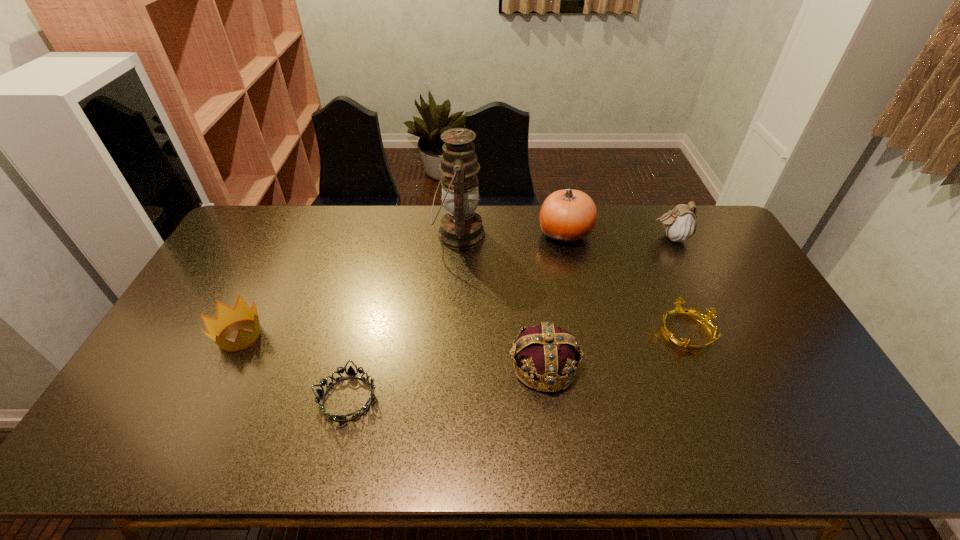
Image resolution: width=960 pixels, height=540 pixels. In the image, there is a desktop. Find the location of `free region at the near right corner`. free region at the near right corner is located at coordinates (808, 453).

You are a GUI agent. You are given a task and a screenshot of the screen. Output one action in this format:
    pyautogui.click(x=<x>, y=<y>)
    Task: Click on the free area in between the second object from left to right and the fifth tallest object
    The height and width of the screenshot is (540, 960).
    Given the screenshot: What is the action you would take?
    pyautogui.click(x=294, y=367)

The width and height of the screenshot is (960, 540). What are the coordinates of `free spot between the lantern and the second crown from left to right` in the screenshot? It's located at (501, 300).

Where is `free space that is in between the sixth shortest object and the shortest crown`? free space that is in between the sixth shortest object and the shortest crown is located at coordinates (625, 282).

Where is `unoccupied position between the leftmost crown and the pumpkin`? The image size is (960, 540). unoccupied position between the leftmost crown and the pumpkin is located at coordinates (402, 284).

Image resolution: width=960 pixels, height=540 pixels. I want to click on vacant space that is in between the pouch and the second crown from left to right, so click(608, 302).

Image resolution: width=960 pixels, height=540 pixels. Identify the location of blank region between the tiara and the leftmost object. [294, 367].

Where is `free spot between the pumpkin and the pouch`? The height and width of the screenshot is (540, 960). free spot between the pumpkin and the pouch is located at coordinates (618, 235).

This screenshot has height=540, width=960. Identify the location of free space between the sixth object from right to left and the third object from left to right. click(x=403, y=316).

You are a GUI agent. You are given a task and a screenshot of the screen. Output one action in this format:
    pyautogui.click(x=<x>, y=<y>)
    Task: Click on the free point between the pouch and the fifth tallest object
    The image size is (960, 540).
    Given the screenshot: What is the action you would take?
    pyautogui.click(x=455, y=286)